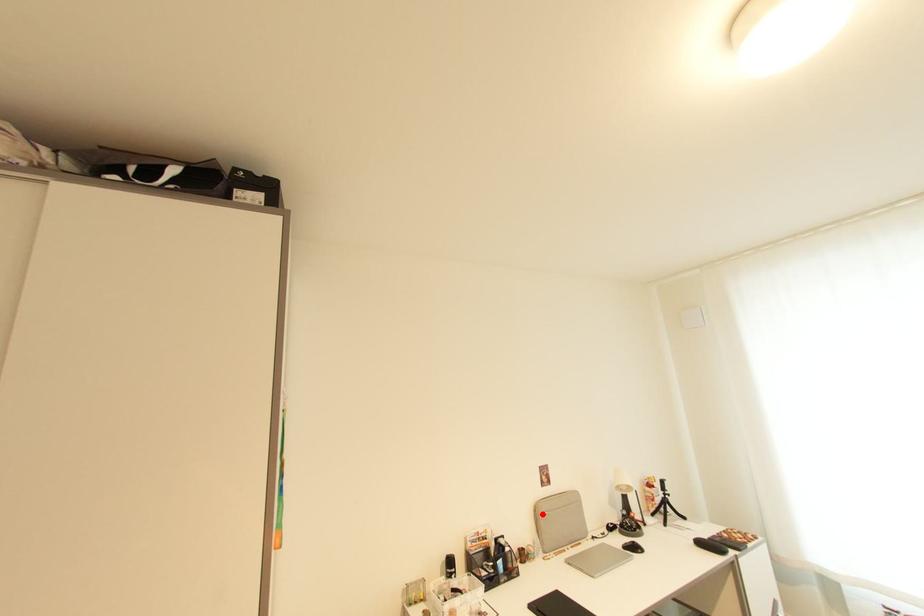
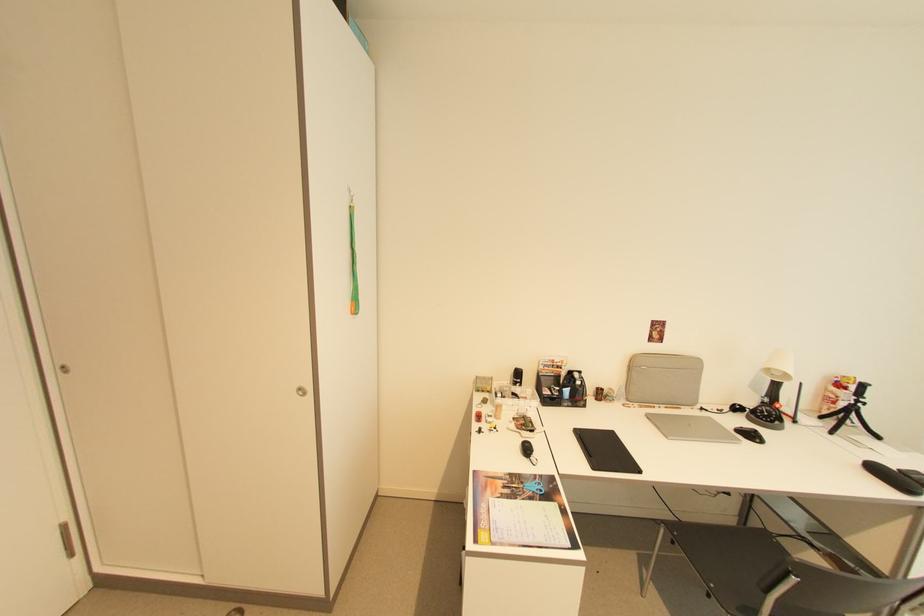
Where in the second image is the point corresponding to the highlighted location from the first image?

(638, 366)